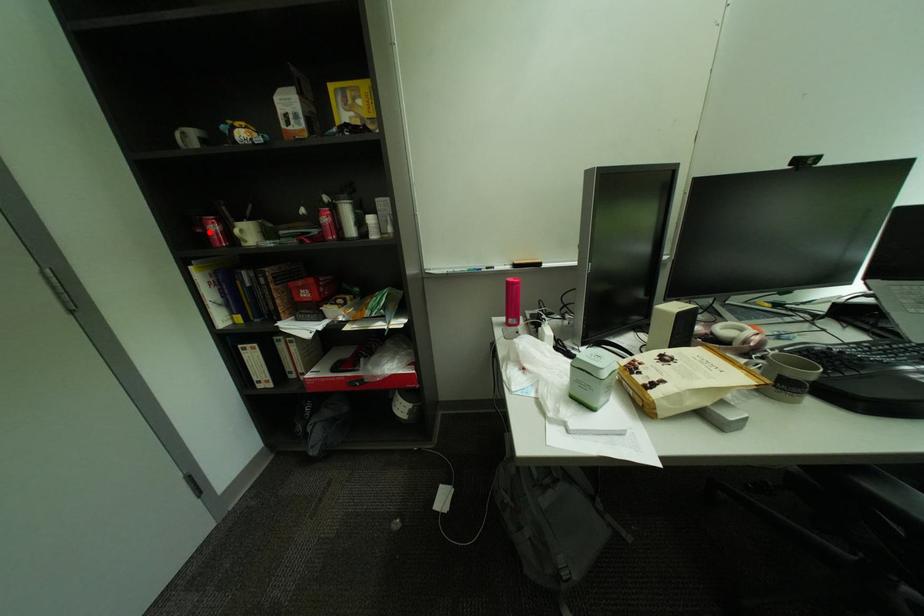
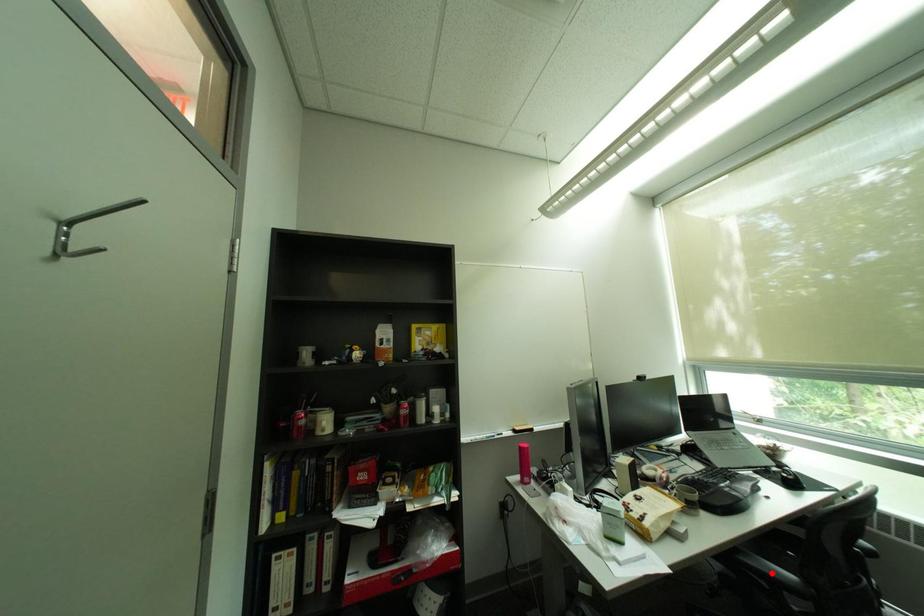
I am providing you with two images of the same scene from different viewpoints. A red point is marked on the first image and another point is marked on the second image. Does the point marked in image1 correspond to the same location as the one in image2?

No